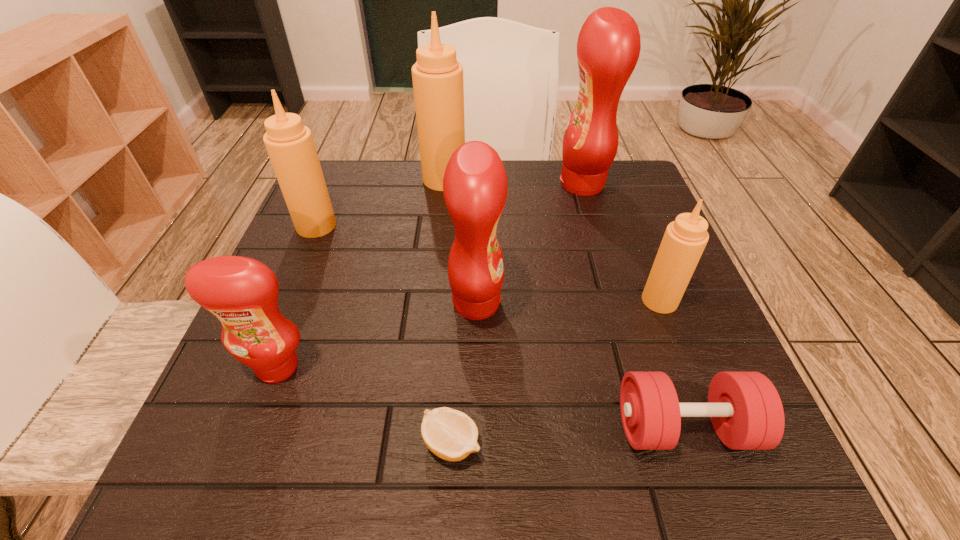
I want to click on the third nearest object, so click(241, 292).

What are the coordinates of `the nearest red condiment` in the screenshot? It's located at (241, 292).

This screenshot has width=960, height=540. I want to click on the second shortest object, so click(746, 411).

Find the location of a particular element. The width and height of the screenshot is (960, 540). yellow lemon is located at coordinates (450, 434).

What are the coordinates of `lemon` in the screenshot? It's located at [450, 434].

Find the location of a particular element. vacant region located on the label side of the rightmost red condiment is located at coordinates (437, 184).

This screenshot has height=540, width=960. What are the coordinates of `vacant space located on the label side of the rightmost red condiment` in the screenshot? It's located at (485, 184).

At what (x,y) coordinates should I click in order to perform the action: click on vacant space situated 0.100m on the label side of the rightmost red condiment. Please return your answer as a coordinate pair (x, y). Looking at the image, I should click on (517, 184).

You are a GUI agent. You are given a task and a screenshot of the screen. Output one action in this format:
    pyautogui.click(x=<x>, y=<y>)
    Task: Click on the vacant space positioned on the right of the second tan condiment from right to left
    This screenshot has width=960, height=540.
    Given the screenshot: What is the action you would take?
    pyautogui.click(x=486, y=179)

In order to click on free space located 0.140m on the back of the leftmost tan condiment in this screenshot , I will do `click(335, 180)`.